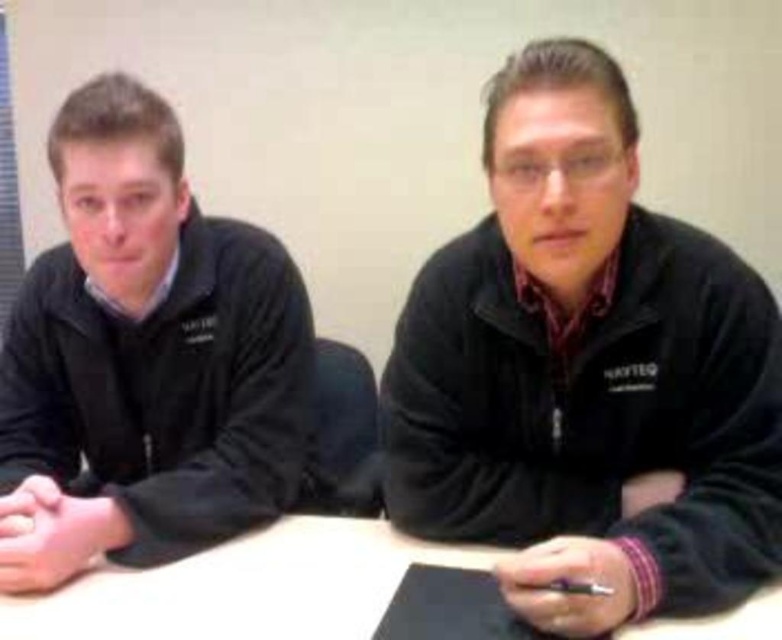
Does black fleece jacket at center appear on the right side of white matte table at center?

Indeed, black fleece jacket at center is positioned on the right side of white matte table at center.

Identify the location of black fleece jacket at center. (585, 371).

You are a GUI agent. You are given a task and a screenshot of the screen. Output one action in this format:
    pyautogui.click(x=<x>, y=<y>)
    Task: Click on the black fleece jacket at center
    
    Given the screenshot: What is the action you would take?
    pyautogui.click(x=585, y=371)

Does black fleece jacket at center come in front of black fleece jacket at left?

Yes, it is.

Can you confirm if black fleece jacket at center is bigger than black fleece jacket at left?

Incorrect, black fleece jacket at center is not larger than black fleece jacket at left.

Which is behind, point (433, 529) or point (178, 314)?

The point (178, 314) is more distant.

Find the location of `black fleece jacket at center`. black fleece jacket at center is located at coordinates (585, 371).

Who is more distant from viewer, (124,291) or (377,561)?

Point (124,291)

Where is `black fleece jacket at left`? The image size is (782, 640). black fleece jacket at left is located at coordinates (145, 356).

Where is `black fleece jacket at left`? The width and height of the screenshot is (782, 640). black fleece jacket at left is located at coordinates (145, 356).